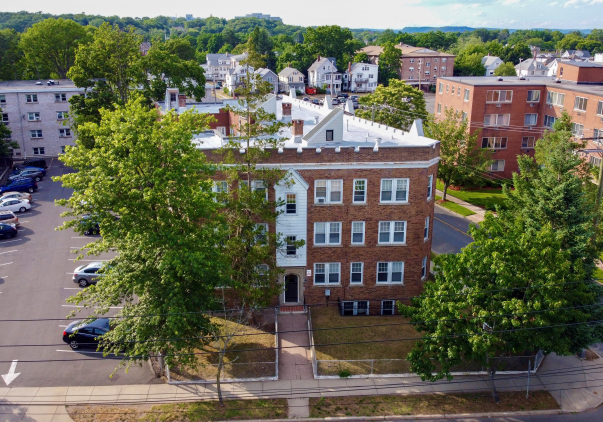
At what (x,y) coordinates should I click in order to perform the action: click on doorway. Please return your answer as a coordinate pair (x, y). The width and height of the screenshot is (603, 422). Looking at the image, I should click on (297, 290).